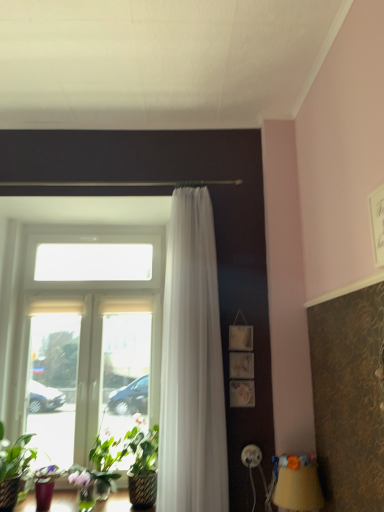
Question: Should I look upward or downward to see yellow fabric lampshade at lower right?

Choices:
 (A) up
 (B) down

Answer: (B)

Question: Would you say clear glass window at center is outside yellow fabric lampshade at lower right?

Choices:
 (A) no
 (B) yes

Answer: (B)

Question: Is clear glass window at center taller than yellow fabric lampshade at lower right?

Choices:
 (A) no
 (B) yes

Answer: (B)

Question: Is clear glass window at center not near yellow fabric lampshade at lower right?

Choices:
 (A) yes
 (B) no

Answer: (A)

Question: Is clear glass window at center at the right side of yellow fabric lampshade at lower right?

Choices:
 (A) yes
 (B) no

Answer: (B)

Question: From a real-world perspective, is clear glass window at center physically below yellow fabric lampshade at lower right?

Choices:
 (A) no
 (B) yes

Answer: (A)

Question: Does clear glass window at center have a larger size compared to yellow fabric lampshade at lower right?

Choices:
 (A) no
 (B) yes

Answer: (B)

Question: Is yellow fabric lampshade at lower right completely or partially outside of clear glass window at center?

Choices:
 (A) no
 (B) yes

Answer: (B)

Question: Does yellow fabric lampshade at lower right appear on the left side of clear glass window at center?

Choices:
 (A) yes
 (B) no

Answer: (B)

Question: Is yellow fabric lampshade at lower right aimed at clear glass window at center?

Choices:
 (A) yes
 (B) no

Answer: (B)

Question: Does yellow fabric lampshade at lower right have a larger size compared to clear glass window at center?

Choices:
 (A) yes
 (B) no

Answer: (B)

Question: Considering the relative sizes of yellow fabric lampshade at lower right and clear glass window at center in the image provided, is yellow fabric lampshade at lower right wider than clear glass window at center?

Choices:
 (A) no
 (B) yes

Answer: (B)

Question: From the image's perspective, does yellow fabric lampshade at lower right appear higher than clear glass window at center?

Choices:
 (A) yes
 (B) no

Answer: (B)

Question: From a real-world perspective, is clear glass window at center under green leafy plant at lower left?

Choices:
 (A) no
 (B) yes

Answer: (A)